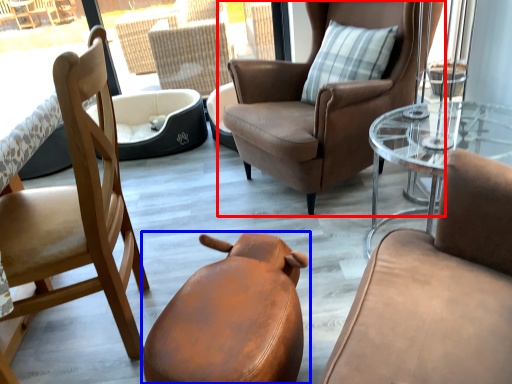
Question: Among these objects, which one is nearest to the camera, chair (highlighted by a red box) or chair (highlighted by a blue box)?

Choices:
 (A) chair
 (B) chair

Answer: (B)